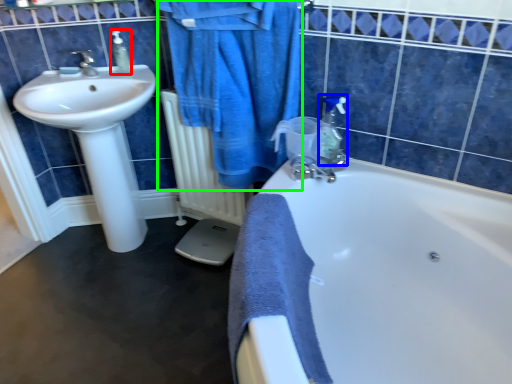
Question: Which object is the closest to the soap dispenser (highlighted by a red box)? Choose among these: soap dispenser (highlighted by a blue box) or bathrobe (highlighted by a green box).

Choices:
 (A) soap dispenser
 (B) bathrobe

Answer: (B)